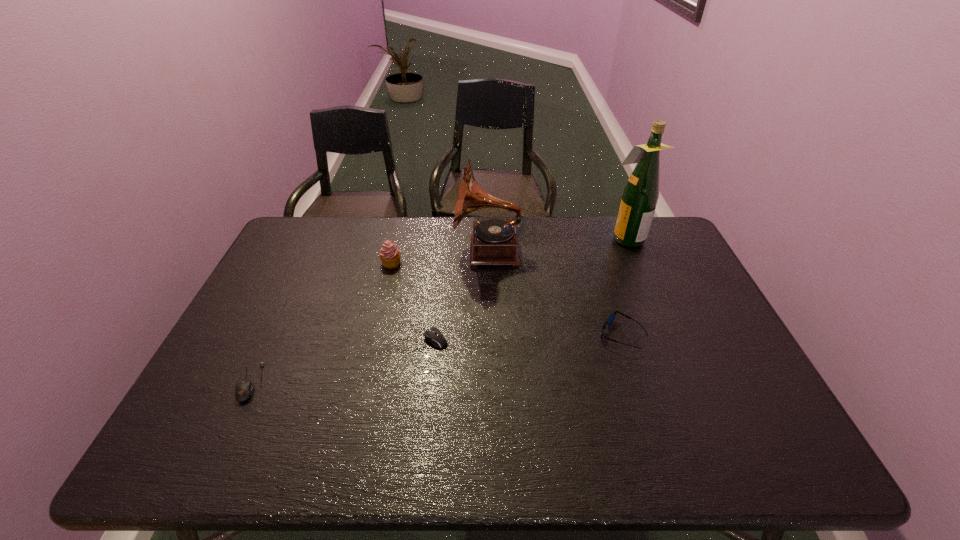
Where is `vacant position located on the front-facing side of the tallest object`? The height and width of the screenshot is (540, 960). vacant position located on the front-facing side of the tallest object is located at coordinates (552, 238).

I want to click on vacant space located on the front-facing side of the tallest object, so point(498,238).

The height and width of the screenshot is (540, 960). Find the location of `blank area located on the front-facing side of the tallest object`. blank area located on the front-facing side of the tallest object is located at coordinates (540, 238).

Identify the location of vacant space located on the horn of the second tallest object. (338, 251).

Locate an element on the screen. The width and height of the screenshot is (960, 540). free space located on the horn of the second tallest object is located at coordinates (383, 251).

Locate an element on the screen. vacant point located on the horn of the second tallest object is located at coordinates 335,251.

Where is `free space located 0.320m on the front of the cupcake`? Image resolution: width=960 pixels, height=540 pixels. free space located 0.320m on the front of the cupcake is located at coordinates (372, 347).

Locate an element on the screen. free spot located at the front of the fifth object from left to right showing the lenses is located at coordinates (501, 335).

Locate an element on the screen. The width and height of the screenshot is (960, 540). free space located at the front of the fifth object from left to right showing the lenses is located at coordinates (523, 335).

Locate an element on the screen. The width and height of the screenshot is (960, 540). free location located 0.150m at the front of the fifth object from left to right showing the lenses is located at coordinates (541, 335).